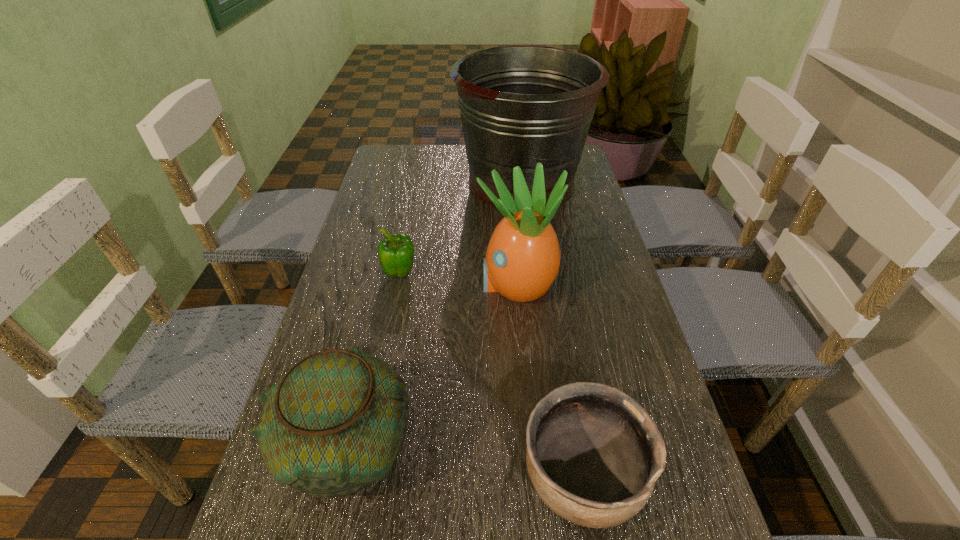
At what (x,y) coordinates should I click in order to perform the action: click on free area in between the bell pepper and the bucket. Please return your answer as a coordinate pair (x, y). The height and width of the screenshot is (540, 960). Looking at the image, I should click on (461, 228).

In order to click on free space between the pineapple and the bell pepper in this screenshot , I will do `click(458, 279)`.

This screenshot has width=960, height=540. I want to click on free spot between the bell pepper and the farthest object, so click(x=461, y=228).

In order to click on object that is the closest to the bucket in this screenshot , I will do `click(522, 260)`.

Find the location of a particular element. Image resolution: width=960 pixels, height=540 pixels. object that is the third closest to the farthest object is located at coordinates (335, 423).

At what (x,y) coordinates should I click in order to perform the action: click on blank area in the image that satisfies the following two spatial constraints: 1. on the back side of the farthest object; 2. on the left side of the third shortest object. Please return your answer as a coordinate pair (x, y). Looking at the image, I should click on (408, 182).

Locate an element on the screen. The height and width of the screenshot is (540, 960). free region that satisfies the following two spatial constraints: 1. on the front side of the bucket; 2. at the entrance of the second tallest object is located at coordinates (535, 284).

In order to click on free location that satisfies the following two spatial constraints: 1. on the back side of the bucket; 2. on the left side of the taller pottery in this screenshot , I will do `click(408, 182)`.

Find the location of `free space that satisfies the following two spatial constraints: 1. on the back side of the bucket; 2. on the right side of the bell pepper`. free space that satisfies the following two spatial constraints: 1. on the back side of the bucket; 2. on the right side of the bell pepper is located at coordinates (418, 182).